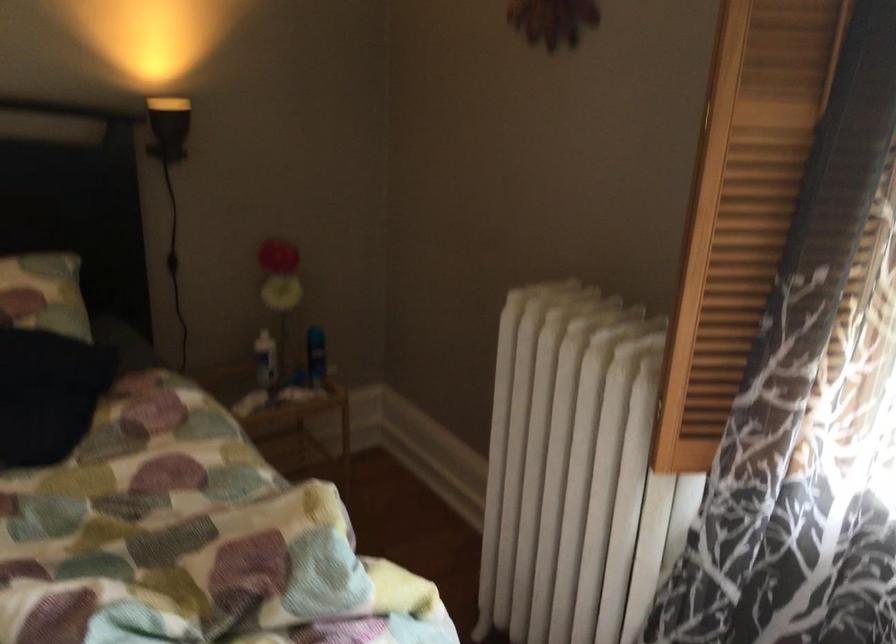
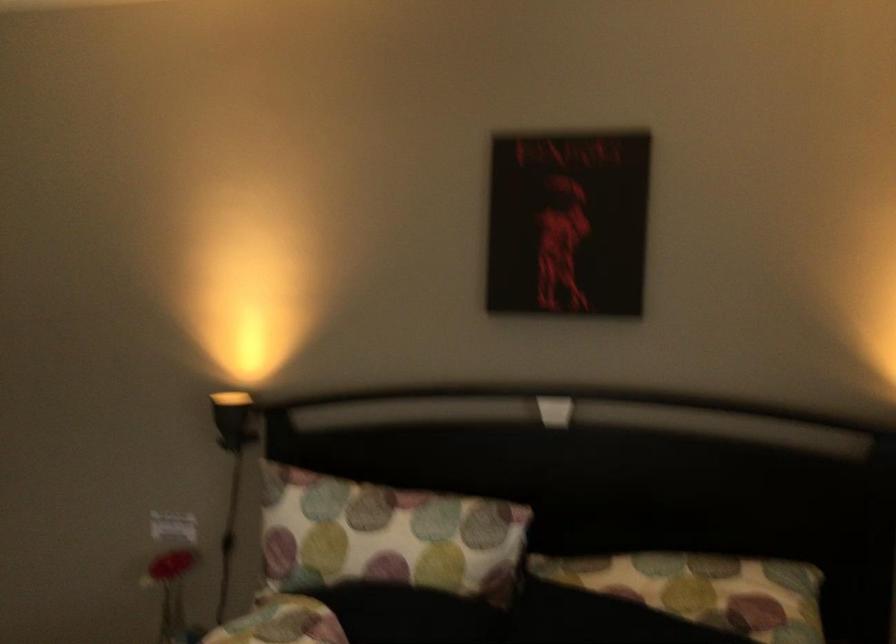
Question: The camera is either moving clockwise (left) or counter-clockwise (right) around the object. The first image is from the beginning of the video and the second image is from the end. Is the camera moving left or right when shooting the video?

Choices:
 (A) Left
 (B) Right

Answer: (B)